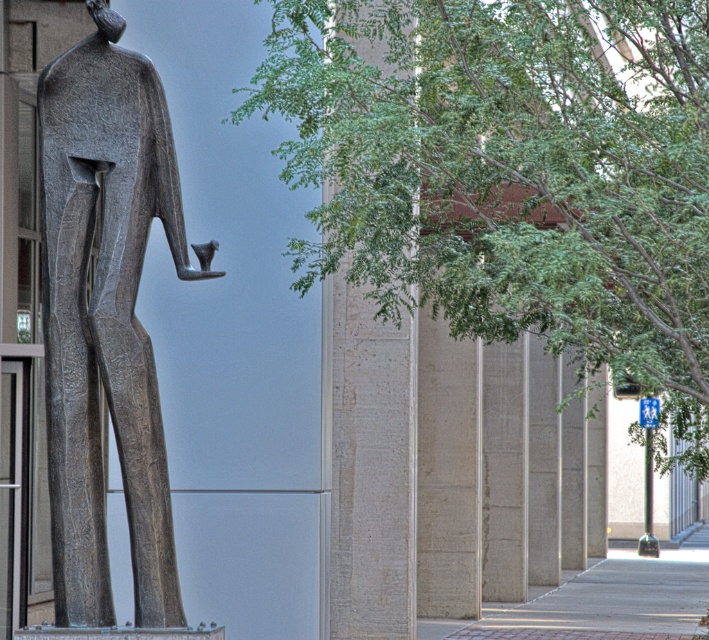
Question: Which object appears closest to the camera in this image?

Choices:
 (A) green leafy tree at center
 (B) smooth concrete pillar at center

Answer: (A)

Question: In this image, where is green leafy tree at center located relative to smooth concrete pillar at center?

Choices:
 (A) right
 (B) left

Answer: (A)

Question: Observing the image, what is the correct spatial positioning of bronze statue at left in reference to smooth concrete pillar at center?

Choices:
 (A) right
 (B) left

Answer: (B)

Question: Which object is farther from the camera taking this photo?

Choices:
 (A) green leafy tree at center
 (B) bronze statue at left
 (C) smooth concrete pillar at center

Answer: (C)

Question: Can you confirm if green leafy tree at center is bigger than smooth concrete pillar at center?

Choices:
 (A) no
 (B) yes

Answer: (B)

Question: Considering the real-world distances, which object is closest to the bronze statue at left?

Choices:
 (A) green leafy tree at center
 (B) smooth concrete pillar at center

Answer: (A)